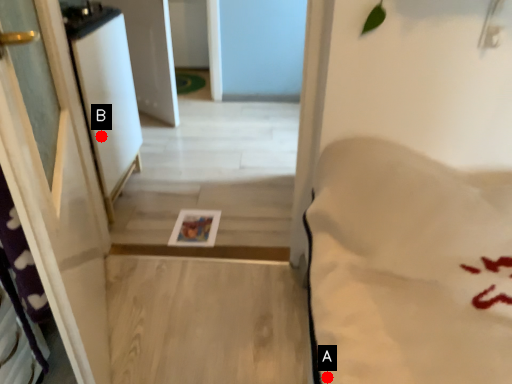
Question: Two points are circled on the image, labeled by A and B beside each circle. Which point appears farthest from the camera in this image?

Choices:
 (A) A is further
 (B) B is further

Answer: (B)